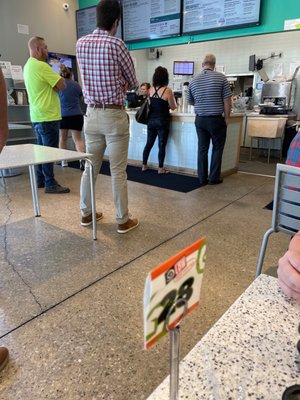
I want to click on tile wall, so click(x=230, y=50).